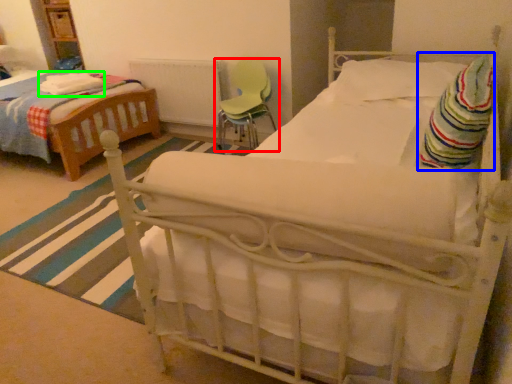
Question: Based on their relative distances, which object is farther from chair (highlighted by a red box)? Choose from blanket (highlighted by a blue box) and blanket (highlighted by a green box).

Choices:
 (A) blanket
 (B) blanket

Answer: (A)